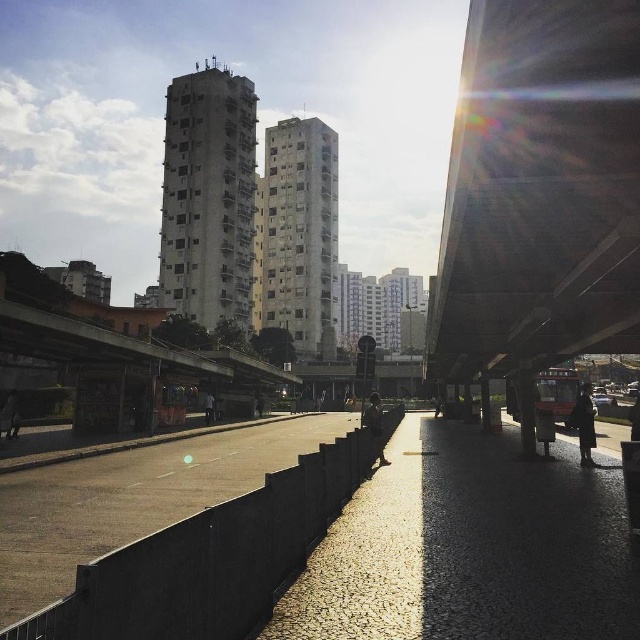
Is dark gray concrete person at center thinner than dark gray fabric jacket at center?

Correct, dark gray concrete person at center's width is less than dark gray fabric jacket at center's.

Who is lower down, dark gray concrete person at center or dark gray fabric jacket at center?

Positioned lower is dark gray fabric jacket at center.

At what (x,y) coordinates should I click in order to perform the action: click on dark gray concrete person at center. Please return your answer as a coordinate pair (x, y). Looking at the image, I should click on (209, 408).

Locate an element on the screen. dark gray concrete person at center is located at coordinates (209, 408).

What do you see at coordinates (374, 426) in the screenshot? I see `dark brown leather jacket at center` at bounding box center [374, 426].

Who is more forward, (376, 392) or (13, 408)?

Point (13, 408) is more forward.

Locate an element on the screen. Image resolution: width=640 pixels, height=640 pixels. dark brown leather jacket at center is located at coordinates (374, 426).

Between point (372, 445) and point (209, 401), which one is positioned in front?

Point (372, 445)

Who is more distant from viewer, (381, 461) or (209, 422)?

The point (209, 422) is behind.

The image size is (640, 640). I want to click on dark brown leather jacket at center, so click(374, 426).